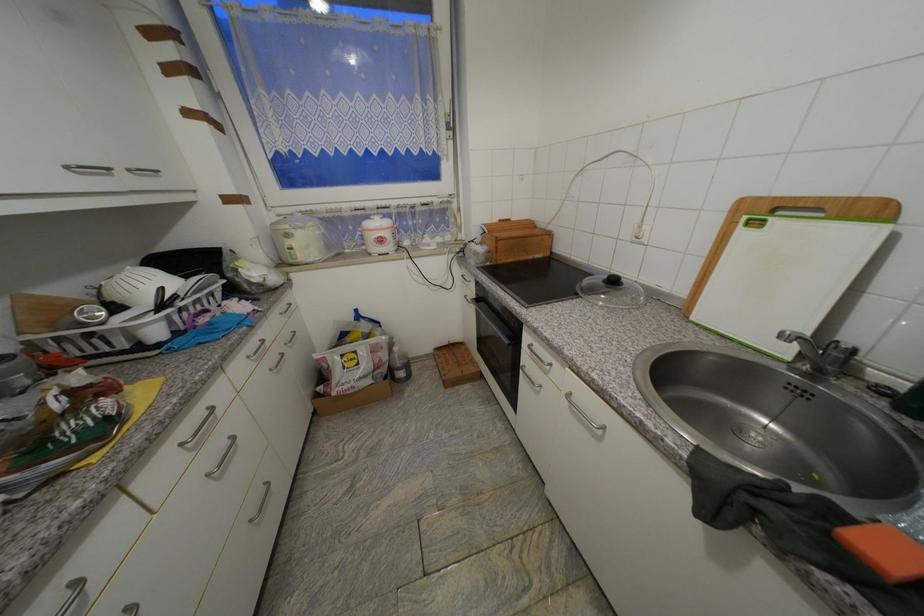
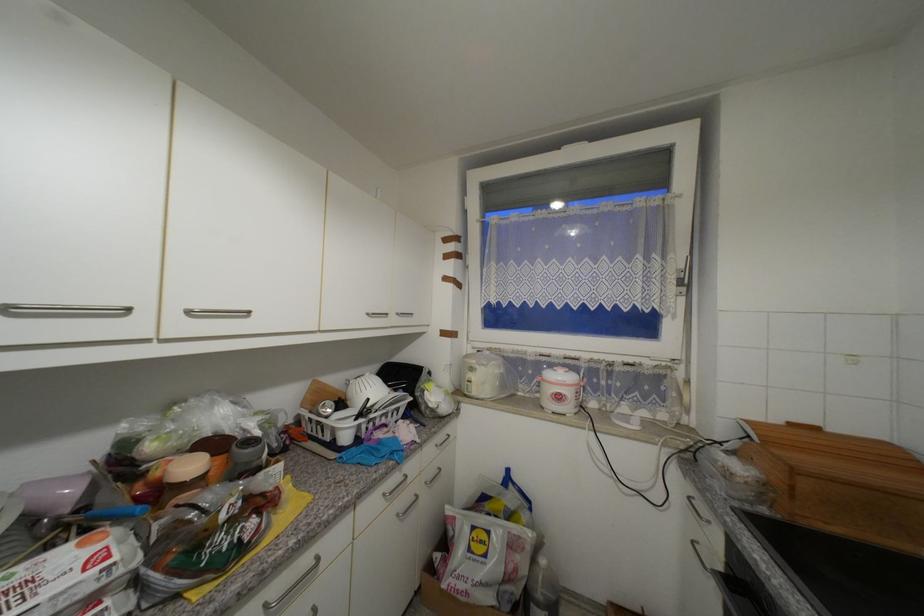
First-person continuous shooting, in which direction is the camera rotating?

The rotation direction of the camera is left-up.